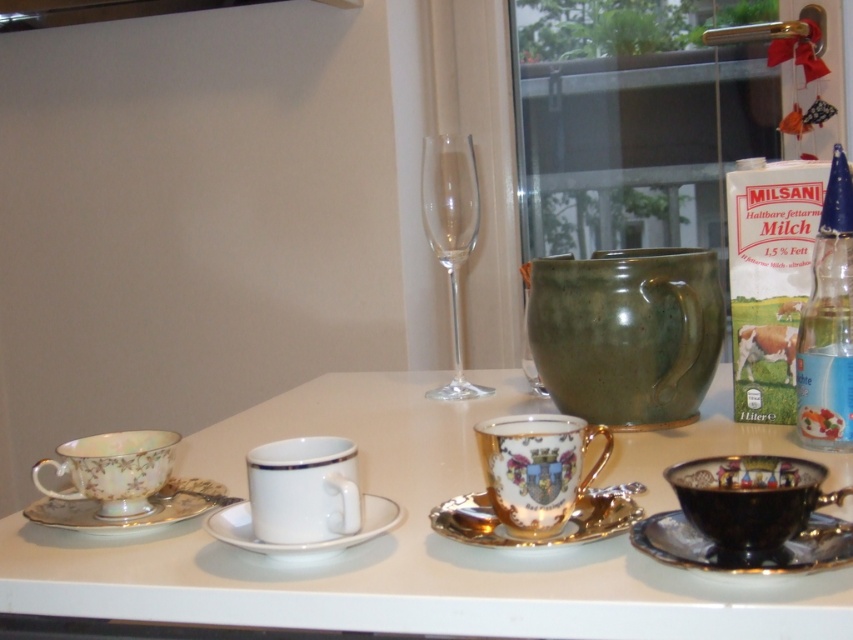
Question: Which is farther from the white porcelain cups at center?

Choices:
 (A) transparent glass wine glass at center
 (B) porcelain floral saucer at left
 (C) white ceramic saucer at center
 (D) porcelain floral teacup at left

Answer: (A)

Question: Which object is positioned closest to the transparent glass wine glass at center?

Choices:
 (A) white porcelain cups at center
 (B) black porcelain teacup at lower right
 (C) porcelain floral saucer at left

Answer: (A)

Question: Which point is closer to the camera?

Choices:
 (A) (670, 472)
 (B) (440, 376)
 (C) (279, 532)
 (D) (454, 372)

Answer: (C)

Question: Is green matte teacup at center closer to camera compared to transparent glass wine glass at center?

Choices:
 (A) yes
 (B) no

Answer: (A)

Question: Does black porcelain teacup at lower right appear on the right side of transparent glass wine glass at center?

Choices:
 (A) yes
 (B) no

Answer: (A)

Question: Does green matte teacup at center have a lesser width compared to gold metallic saucer at center?

Choices:
 (A) no
 (B) yes

Answer: (A)